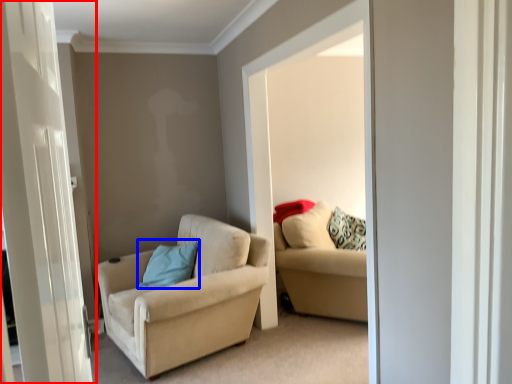
Question: Which object is further to the camera taking this photo, door (highlighted by a red box) or pillow (highlighted by a blue box)?

Choices:
 (A) door
 (B) pillow

Answer: (B)